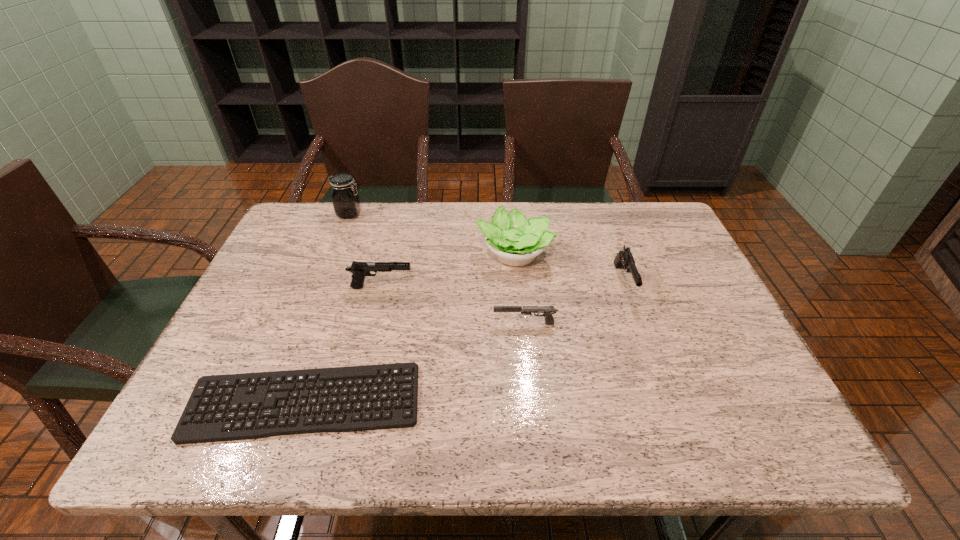
The height and width of the screenshot is (540, 960). What are the coordinates of `free space in the image that satisfies the following two spatial constraints: 1. at the aiming end of the leftmost gun; 2. on the front side of the shortest object` in the screenshot? It's located at 354,402.

Locate an element on the screen. The width and height of the screenshot is (960, 540). vacant space that satisfies the following two spatial constraints: 1. on the back side of the computer keyboard; 2. on the lid of the jar is located at coordinates (368, 214).